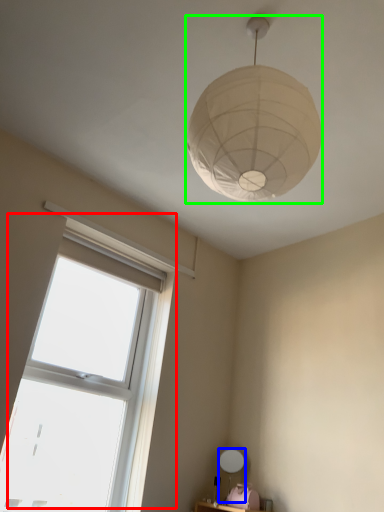
Question: Which is nearer to the window (highlighted by a red box)? table lamp (highlighted by a blue box) or lamp (highlighted by a green box).

Choices:
 (A) table lamp
 (B) lamp

Answer: (A)